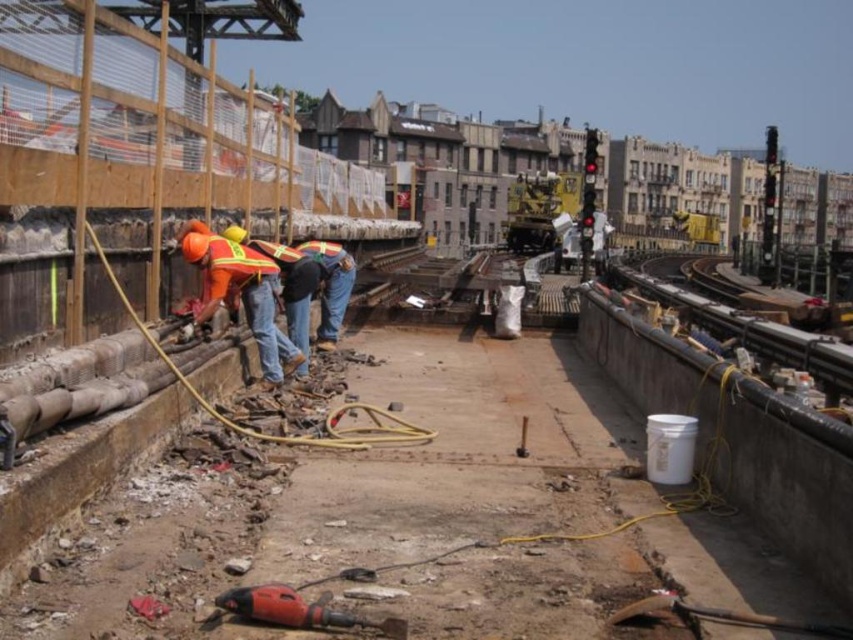
Question: Does red plastic drill at lower center have a smaller size compared to reflective yellow safety vest at left?

Choices:
 (A) no
 (B) yes

Answer: (B)

Question: Among these objects, which one is farthest from the camera?

Choices:
 (A) red plastic drill at lower center
 (B) reflective yellow safety vest at left

Answer: (B)

Question: Among these objects, which one is farthest from the camera?

Choices:
 (A) reflective yellow safety vest at left
 (B) red plastic drill at lower center

Answer: (A)

Question: Which of the following is the farthest from the observer?

Choices:
 (A) (247, 620)
 (B) (223, 266)

Answer: (B)

Question: From the image, what is the correct spatial relationship of red plastic drill at lower center in relation to reflective yellow safety vest at left?

Choices:
 (A) left
 (B) right

Answer: (B)

Question: Is red plastic drill at lower center smaller than reflective yellow safety vest at left?

Choices:
 (A) no
 (B) yes

Answer: (B)